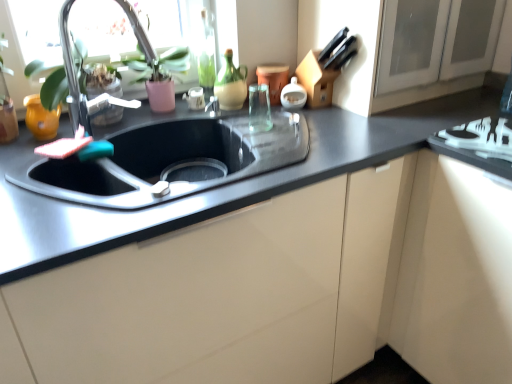
Question: In terms of width, does white glossy stove at lower right look wider or thinner when compared to matte glass window screen at upper left?

Choices:
 (A) wide
 (B) thin

Answer: (B)

Question: From their relative heights in the image, would you say white glossy stove at lower right is taller or shorter than matte glass window screen at upper left?

Choices:
 (A) tall
 (B) short

Answer: (B)

Question: Which of these objects is positioned closest to the matte glass window screen at upper left?

Choices:
 (A) white glossy soap dispenser at upper center, which is the 4th appliance from left to right
 (B) white glossy stove at lower right
 (C) matte yellow vase at left, marked as the 1th appliance in a left-to-right arrangement
 (D) matte white cabinet at center
 (E) black granite countertop at center

Answer: (C)

Question: Which object is positioned farthest from the white glossy soap dispenser at upper center, acting as the 1th appliance starting from the right?

Choices:
 (A) black granite countertop at center
 (B) matte white cabinet at center
 (C) matte yellow vase at left, arranged as the fourth appliance when viewed from the right
 (D) matte ceramic cup at upper center, the third appliance viewed from the left
 (E) matte glass window screen at upper left

Answer: (C)